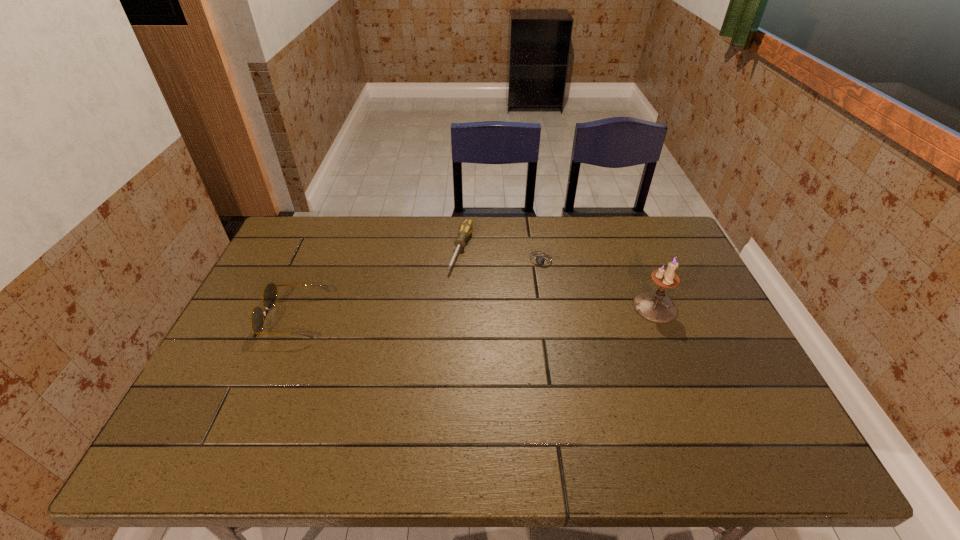
Where is `the leftmost object`? The height and width of the screenshot is (540, 960). the leftmost object is located at coordinates (270, 291).

Where is `sunglasses`? The width and height of the screenshot is (960, 540). sunglasses is located at coordinates (270, 291).

You are a GUI agent. You are given a task and a screenshot of the screen. Output one action in this format:
    pyautogui.click(x=<x>, y=<y>)
    Task: Click on the tallest object
    
    Given the screenshot: What is the action you would take?
    pyautogui.click(x=653, y=306)

What are the coordinates of `the rightmost object` in the screenshot? It's located at (653, 306).

Where is `screwdriver`? screwdriver is located at coordinates (466, 228).

Find the location of a particular element. Image resolution: width=960 pixels, height=540 pixels. the third object from right to left is located at coordinates (466, 228).

Identify the location of the third object from left to right. Image resolution: width=960 pixels, height=540 pixels. (540, 260).

In order to click on the shortest object in this screenshot , I will do `click(540, 260)`.

Locate an element on the screen. free spot located on the back of the rightmost object is located at coordinates (635, 258).

At what (x,y) coordinates should I click in order to perform the action: click on free space located 0.350m at the tip of the third object from right to left. Please return your answer as a coordinate pair (x, y). The image size is (960, 540). Looking at the image, I should click on (422, 364).